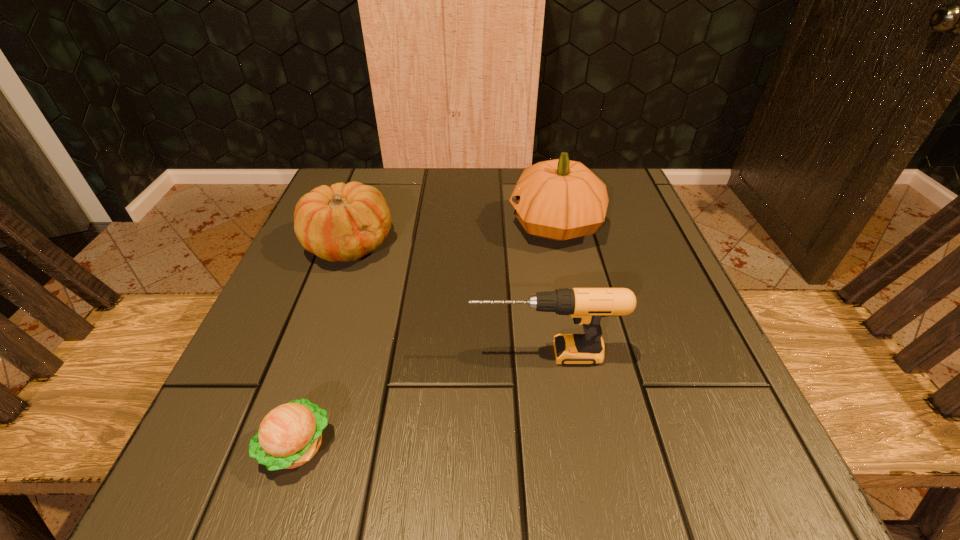
I want to click on vacant space at the far right corner of the desktop, so click(x=607, y=213).

Find the location of `vacant space in between the hamburger and the second shortest object`. vacant space in between the hamburger and the second shortest object is located at coordinates (323, 345).

At what (x,y) coordinates should I click in order to perform the action: click on free space between the left gourd and the hamburger. Please return your answer as a coordinate pair (x, y). The image size is (960, 540). Looking at the image, I should click on (323, 345).

Find the location of a particular element. Image resolution: width=960 pixels, height=540 pixels. vacant area that lies between the right gourd and the second shortest object is located at coordinates (452, 235).

This screenshot has height=540, width=960. Find the location of `free space between the shortest object and the third farthest object`. free space between the shortest object and the third farthest object is located at coordinates (420, 400).

Find the location of a particular element. The width and height of the screenshot is (960, 540). unoccupied position between the third tallest object and the second tallest object is located at coordinates (446, 299).

Where is `empty space between the shortest object and the second nearest object`? The image size is (960, 540). empty space between the shortest object and the second nearest object is located at coordinates (420, 400).

Where is `unoccupied position between the drill and the hamburger`? This screenshot has height=540, width=960. unoccupied position between the drill and the hamburger is located at coordinates (420, 400).

The height and width of the screenshot is (540, 960). Find the location of `unoccupied position between the right gourd and the drill`. unoccupied position between the right gourd and the drill is located at coordinates (550, 289).

The image size is (960, 540). Identify the location of free space between the hamburger and the drill. (420, 400).